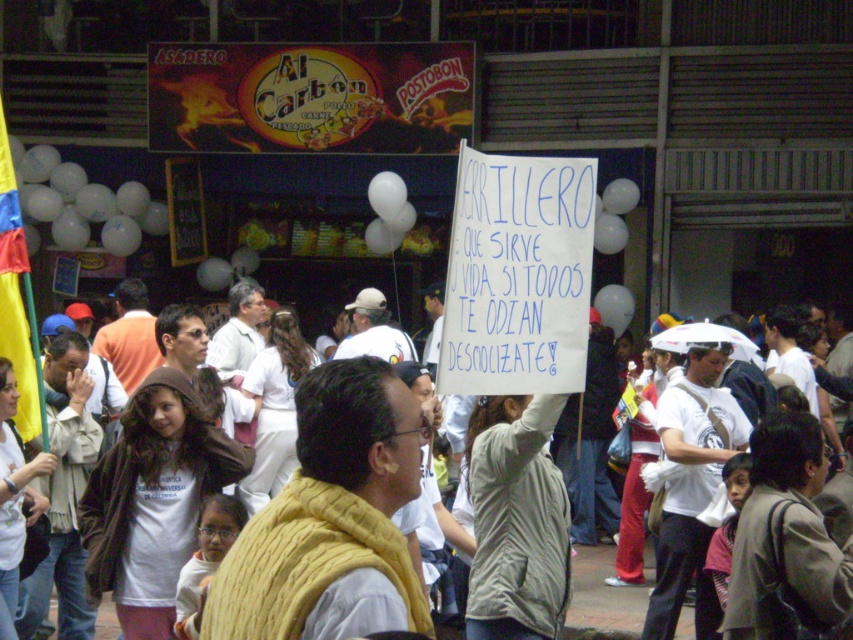
You are a photographer positioned at the origin point of the image. You want to capture a photo that includes both the point at (656,422) and the point at (239,280). Which point should you focus on first to ensure both are in frame?

You should focus on the point at (656,422) first because it is closer to you than the point at (239,280), ensuring both points remain in the frame.

You are a photographer trying to capture a candid shot of the two central participants wearing the yellow knitted vest at center and orange cotton shirt at center. From the perspective of someone standing behind the crowd, which one would you adjust your camera to focus on first to ensure both are in frame?

The orange cotton shirt at center should be focused on first since the yellow knitted vest at center is to its right, so adjusting focus starting from the leftmost participant ensures both are captured in the frame.